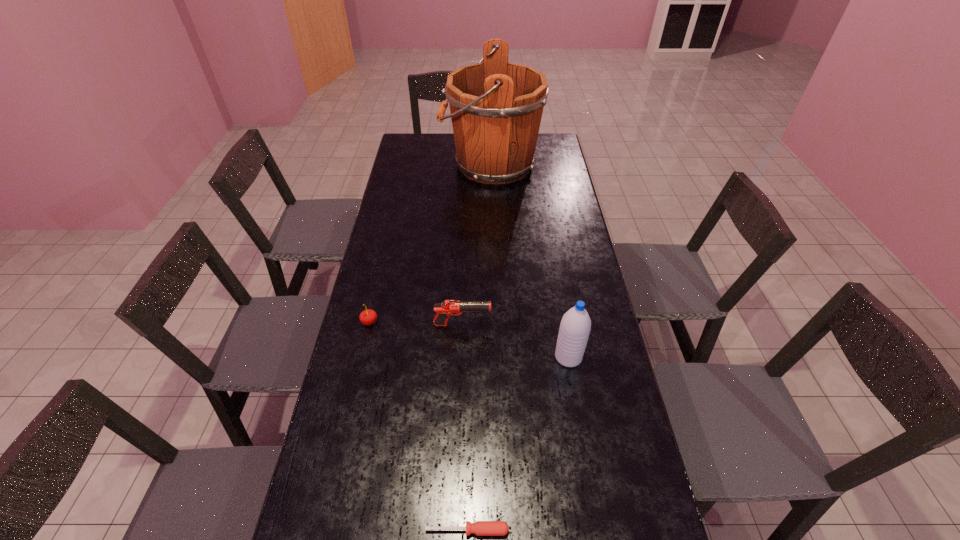
The image size is (960, 540). Identify the location of free space that satisfies the following two spatial constraints: 1. on the back side of the fourth farthest object; 2. with the handle on the side of the bucket. (536, 165).

Locate an element on the screen. The width and height of the screenshot is (960, 540). free spot that satisfies the following two spatial constraints: 1. with the handle on the side of the fourth shortest object; 2. on the right side of the farthest object is located at coordinates (496, 357).